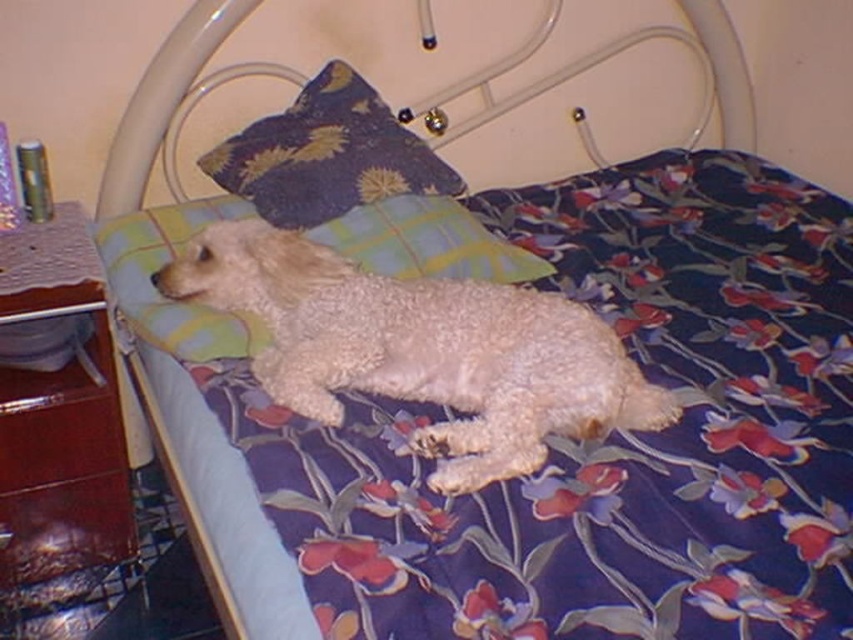
You are a photographer setting up a shot of the dog on the bed. You want to place a small prop between the green plaid pillow at upper center and the dark blue fabric pillow at upper center. Where should you position the prop so it is between them?

The green plaid pillow at upper center is to the right of the dark blue fabric pillow at upper center, so place the prop between them by positioning it to the right of the dark blue fabric pillow at upper center and to the left of the green plaid pillow at upper center.

You are trying to find the white fluffy dog at center in the image. Where is it located relative to the dark blue fabric pillow at upper center?

The white fluffy dog at center is positioned on the right side of the dark blue fabric pillow at upper center.

You are a pet owner who wants to place a new toy for your dog. The toy needs to be within 15 inches of the white fluffy dog at center to ensure it can reach it. Is the dark blue fabric pillow at upper center within this distance?

The white fluffy dog at center is 17.47 inches away from the dark blue fabric pillow at upper center. Since 17.47 inches is greater than 15 inches, the pillow is outside the dog s reachable distance. Therefore, the toy placed near the dark blue fabric pillow at upper center would be too far for the dog to reach.